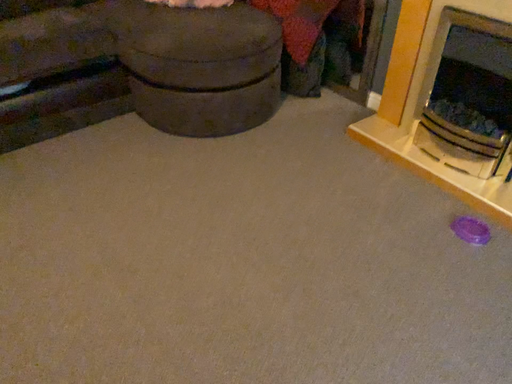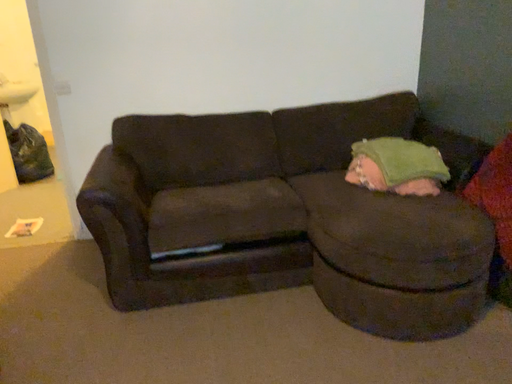
Question: Which way did the camera rotate in the video?

Choices:
 (A) rotated right
 (B) rotated left

Answer: (B)